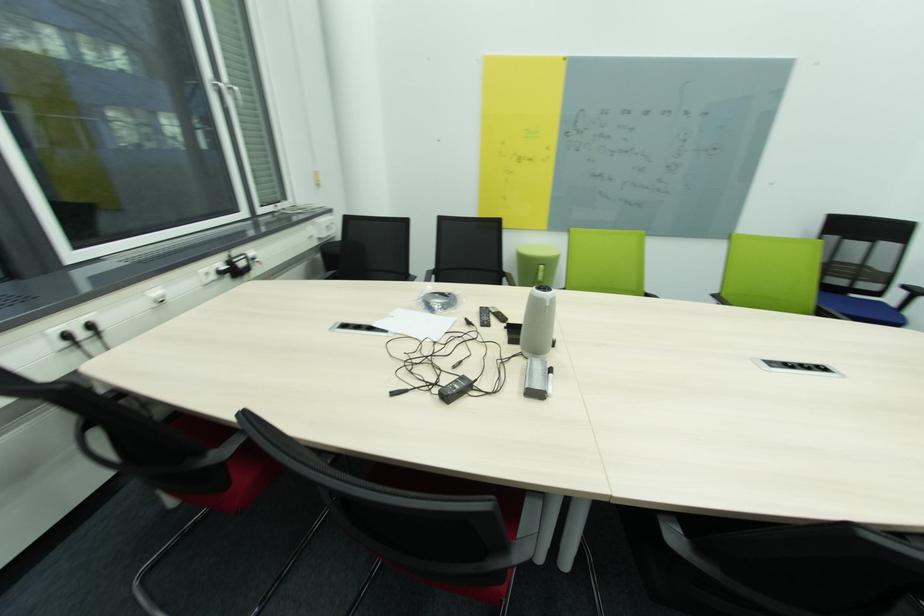
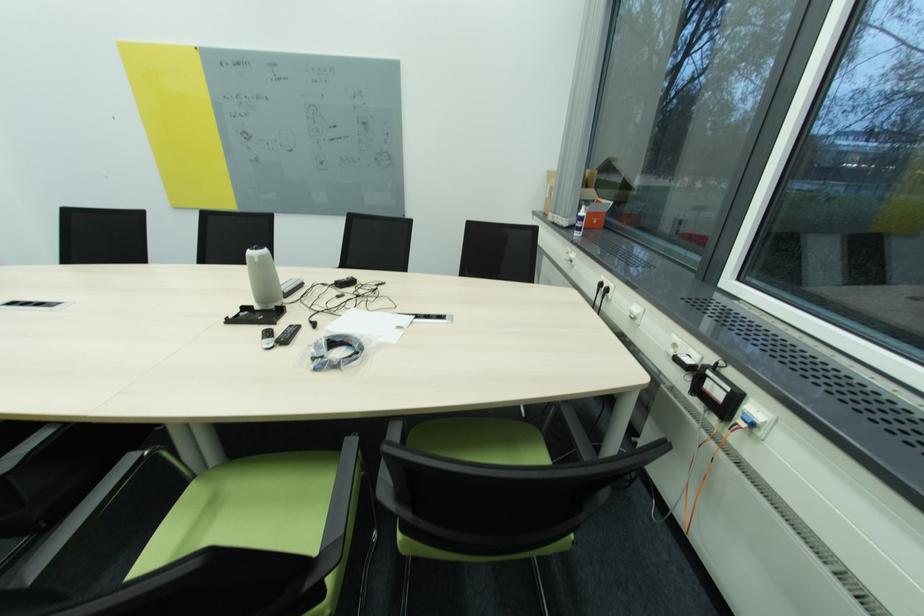
Locate, in the second image, the point that corresponds to (x=493, y=326) in the first image.

(296, 328)